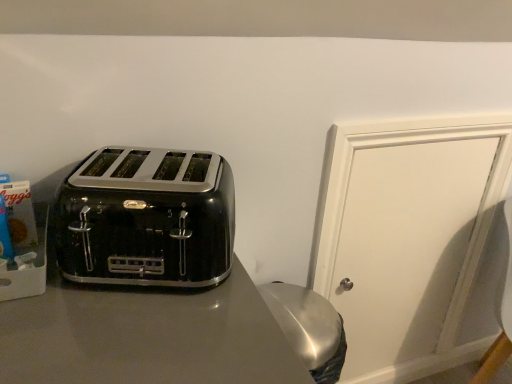
Question: Considering their positions, is white matte door at center located in front of or behind black glossy toaster at left?

Choices:
 (A) front
 (B) behind

Answer: (B)

Question: Would you say white matte door at center is to the left or to the right of black glossy toaster at left in the picture?

Choices:
 (A) left
 (B) right

Answer: (B)

Question: Is white matte door at center situated inside black glossy toaster at left or outside?

Choices:
 (A) outside
 (B) inside

Answer: (A)

Question: Is black glossy toaster at left in front of or behind white matte door at center in the image?

Choices:
 (A) front
 (B) behind

Answer: (A)

Question: From the image's perspective, is black glossy toaster at left located above or below white matte door at center?

Choices:
 (A) above
 (B) below

Answer: (A)

Question: Is black glossy toaster at left bigger or smaller than white matte door at center?

Choices:
 (A) small
 (B) big

Answer: (A)

Question: Is black glossy toaster at left to the left or to the right of white matte door at center in the image?

Choices:
 (A) left
 (B) right

Answer: (A)